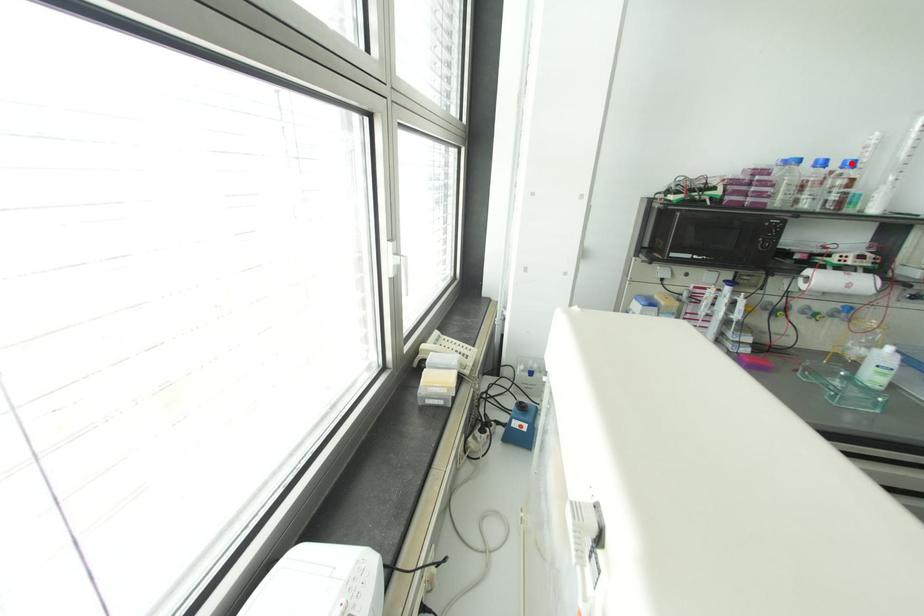
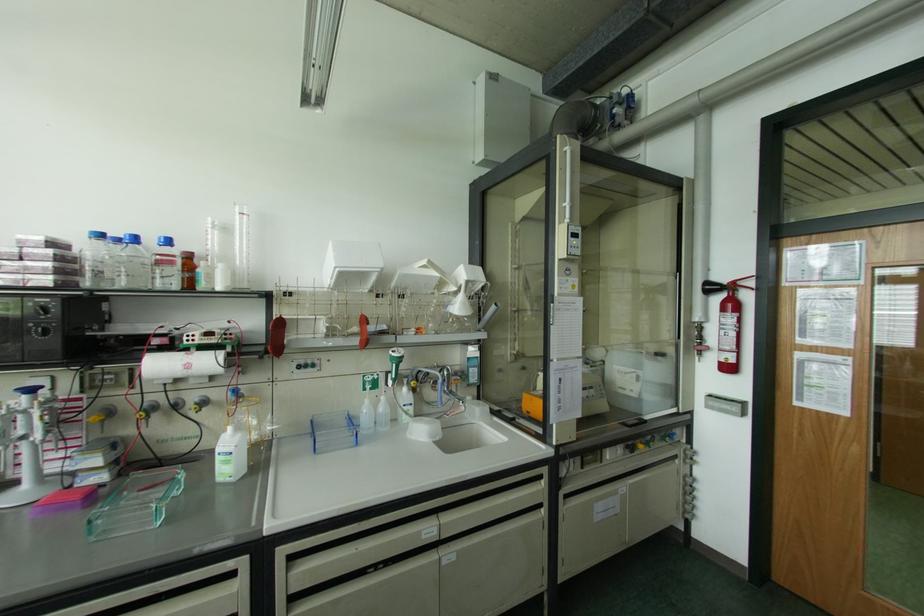
Question: I am providing you with two images of the same scene from different viewpoints. A red point is marked on the first image. At the location where the point appears in image 1, is it still visible in image 2?

Choices:
 (A) Yes
 (B) No

Answer: (A)